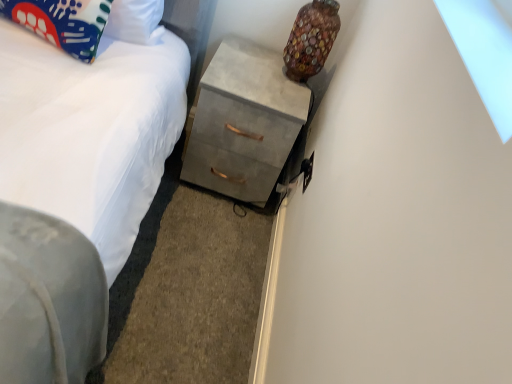
At what (x,y) coordinates should I click in order to perform the action: click on empty space that is ontop of concrete gray chest of drawers at center (from a real-world perspective). Please return your answer as a coordinate pair (x, y). Looking at the image, I should click on (250, 65).